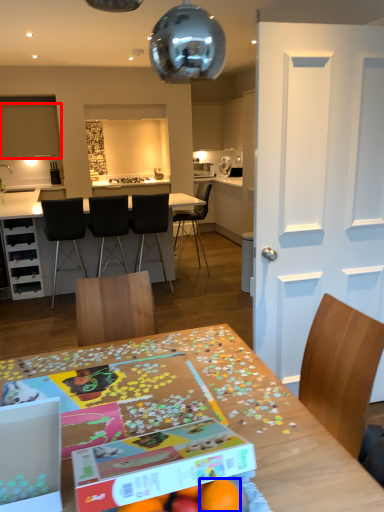
Question: Which point is closer to the camera, cabinetry (highlighted by a red box) or orange (highlighted by a blue box)?

Choices:
 (A) cabinetry
 (B) orange

Answer: (B)